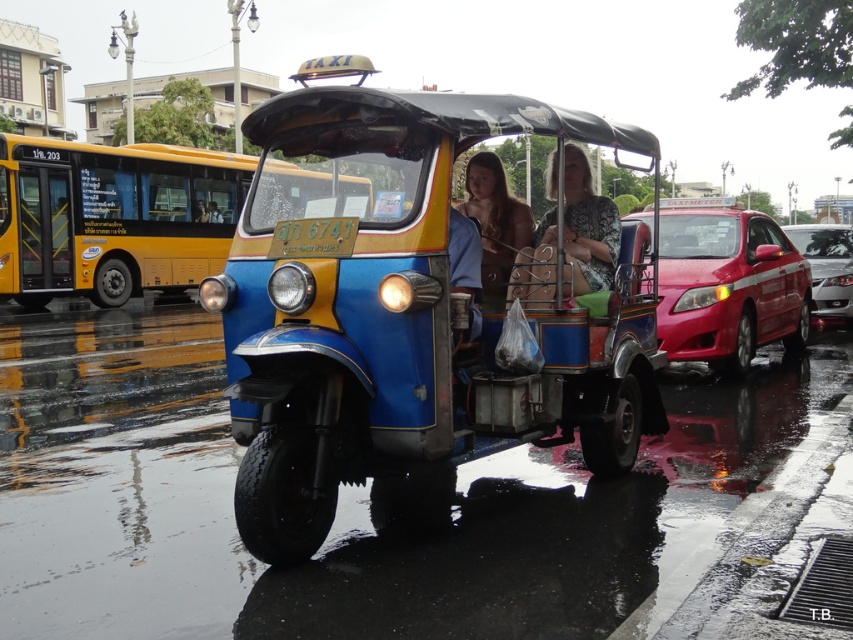
You are a pedestrian trying to cross the street where the yellow metallic bus at left and the shiny red car at right are present. Which vehicle should you wait for to pass first if you want to cross safely?

The yellow metallic bus at left is bigger than the shiny red car at right, so it may take longer to pass. You should wait for the yellow metallic bus at left to completely pass before crossing.